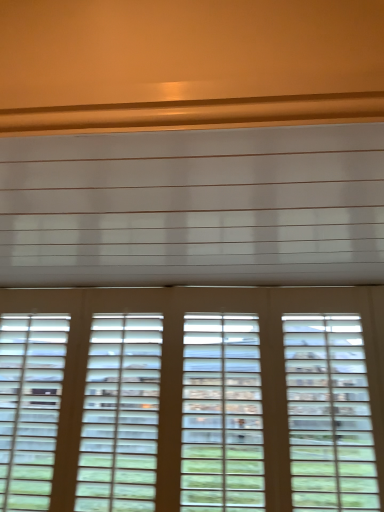
This screenshot has width=384, height=512. Find the location of `white matte blind at upper center`. white matte blind at upper center is located at coordinates (194, 207).

Measure the distance between point (286,185) and camera.

Point (286,185) and camera are 27.09 inches apart.

Describe the element at coordinates (194, 207) in the screenshot. I see `white matte blind at upper center` at that location.

Where is `wooden blinds at bottom`? wooden blinds at bottom is located at coordinates (192, 398).

What do you see at coordinates (192, 398) in the screenshot?
I see `wooden blinds at bottom` at bounding box center [192, 398].

Where is `white matte blind at upper center`? The image size is (384, 512). white matte blind at upper center is located at coordinates (194, 207).

From the picture: Which is more to the left, white matte blind at upper center or wooden blinds at bottom?

Positioned to the left is white matte blind at upper center.

Between white matte blind at upper center and wooden blinds at bottom, which one is positioned in front?

white matte blind at upper center is closer to the camera.

Which is behind, point (66, 201) or point (341, 342)?

Point (341, 342)

From the image's perspective, between white matte blind at upper center and wooden blinds at bottom, which one is located above?

From the image's view, white matte blind at upper center is above.

From a real-world perspective, which is physically below, white matte blind at upper center or wooden blinds at bottom?

wooden blinds at bottom.

Which object is thinner, white matte blind at upper center or wooden blinds at bottom?

wooden blinds at bottom.

Considering the sizes of objects white matte blind at upper center and wooden blinds at bottom in the image provided, who is shorter, white matte blind at upper center or wooden blinds at bottom?

Standing shorter between the two is white matte blind at upper center.

Is white matte blind at upper center bigger than wooden blinds at bottom?

Indeed, white matte blind at upper center has a larger size compared to wooden blinds at bottom.

Is wooden blinds at bottom a part of white matte blind at upper center?

No, white matte blind at upper center does not contain wooden blinds at bottom.

Are white matte blind at upper center and wooden blinds at bottom far apart?

They are positioned close to each other.

Could you tell me if white matte blind at upper center is facing wooden blinds at bottom?

No, white matte blind at upper center is not turned towards wooden blinds at bottom.

How different are the orientations of white matte blind at upper center and wooden blinds at bottom in degrees?

0.214 degrees.

I want to click on window on the right of the white matte blind at upper center, so click(192, 398).

Between wooden blinds at bottom and white matte blind at upper center, which one appears on the right side from the viewer's perspective?

wooden blinds at bottom.

Based on the photo, which is in front, wooden blinds at bottom or white matte blind at upper center?

white matte blind at upper center.

Which is less distant, (174, 509) or (1, 146)?

The point (1, 146) is in front.

From the image's perspective, is wooden blinds at bottom positioned above or below white matte blind at upper center?

wooden blinds at bottom is below white matte blind at upper center.

From a real-world perspective, between wooden blinds at bottom and white matte blind at upper center, who is vertically lower?

From a 3D spatial view, wooden blinds at bottom is below.

Does wooden blinds at bottom have a greater width compared to white matte blind at upper center?

No.

From the picture: Can you confirm if wooden blinds at bottom is taller than white matte blind at upper center?

Indeed, wooden blinds at bottom has a greater height compared to white matte blind at upper center.

Does wooden blinds at bottom have a smaller size compared to white matte blind at upper center?

Correct, wooden blinds at bottom occupies less space than white matte blind at upper center.

Consider the image. Which is correct: wooden blinds at bottom is inside white matte blind at upper center, or outside of it?

The correct answer is: outside.

Is wooden blinds at bottom far away from white matte blind at upper center?

No, there isn't a large distance between wooden blinds at bottom and white matte blind at upper center.

Could you tell me if wooden blinds at bottom is facing white matte blind at upper center?

Yes, wooden blinds at bottom is aimed at white matte blind at upper center.

Measure the distance from wooden blinds at bottom to white matte blind at upper center.

wooden blinds at bottom and white matte blind at upper center are 18.97 inches apart.

The height and width of the screenshot is (512, 384). Identify the location of blind that appears above the wooden blinds at bottom (from the image's perspective). (194, 207).

Where is `window that appears below the white matte blind at upper center (from a real-world perspective)`? This screenshot has width=384, height=512. window that appears below the white matte blind at upper center (from a real-world perspective) is located at coordinates (192, 398).

Locate an element on the screen. This screenshot has height=512, width=384. blind in front of the wooden blinds at bottom is located at coordinates (194, 207).